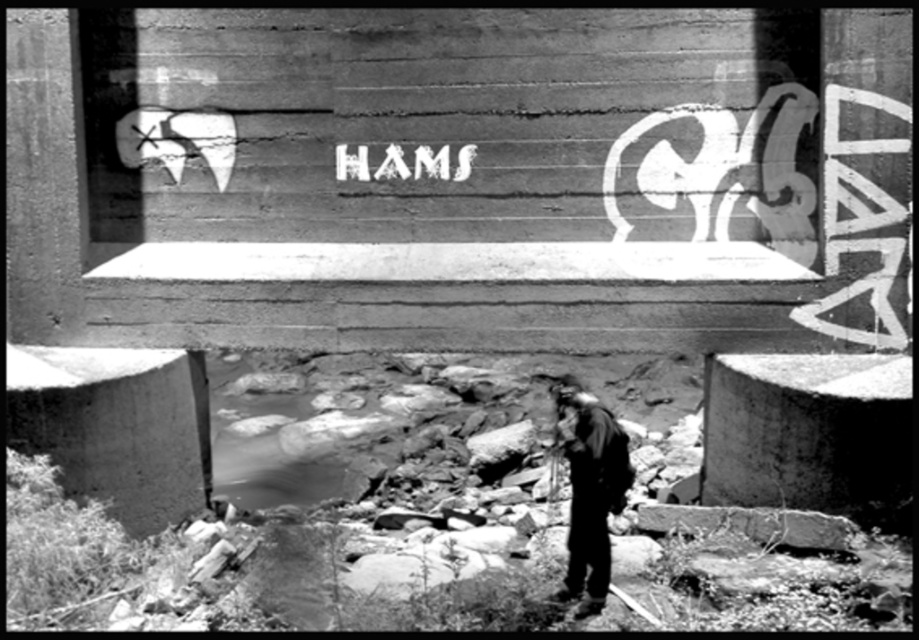
Can you confirm if dark gray fabric jacket at lower center is wider than white matte text at center?

No.

Is dark gray fabric jacket at lower center positioned at the back of white matte text at center?

Result: That is False.

Where is `dark gray fabric jacket at lower center`? This screenshot has height=640, width=919. dark gray fabric jacket at lower center is located at coordinates (588, 490).

You are a GUI agent. You are given a task and a screenshot of the screen. Output one action in this format:
    pyautogui.click(x=<x>, y=<y>)
    Task: Click on the dark gray fabric jacket at lower center
    This screenshot has height=640, width=919.
    Given the screenshot: What is the action you would take?
    pyautogui.click(x=588, y=490)